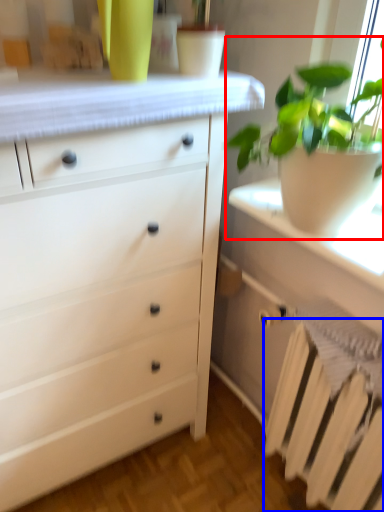
Question: Which object is further to the camera taking this photo, houseplant (highlighted by a red box) or radiator (highlighted by a blue box)?

Choices:
 (A) houseplant
 (B) radiator

Answer: (B)